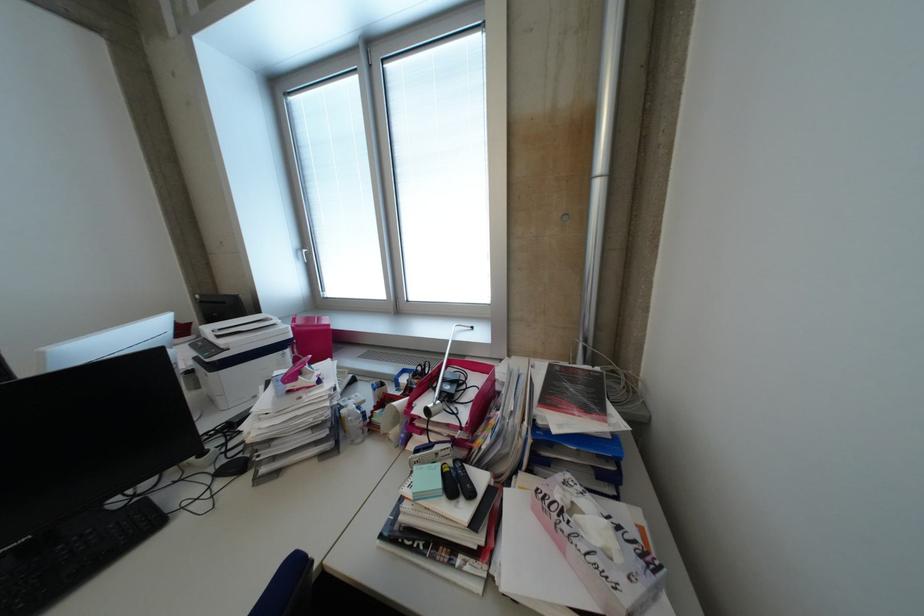
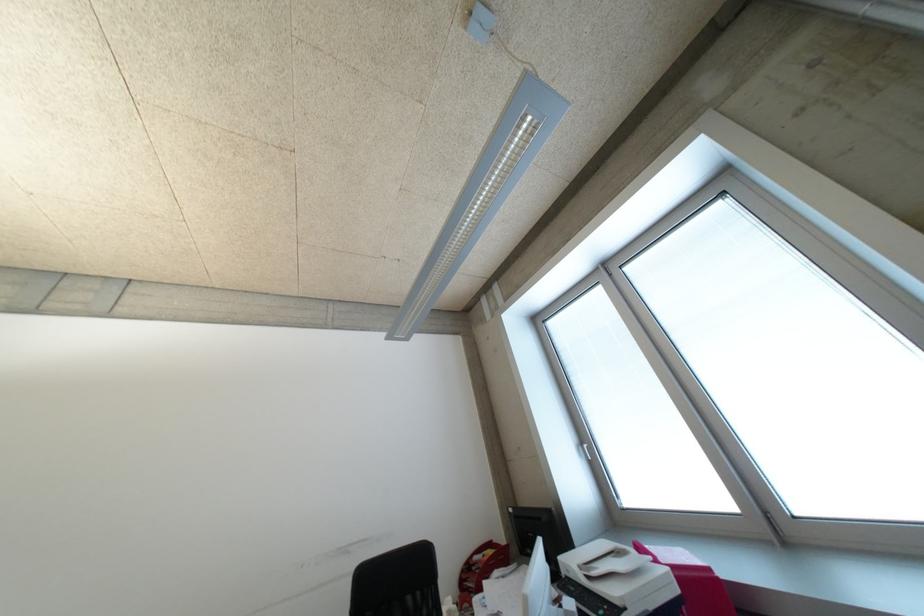
Find the pixel in the second image that matches the point at 299,337 in the first image.

(687, 591)